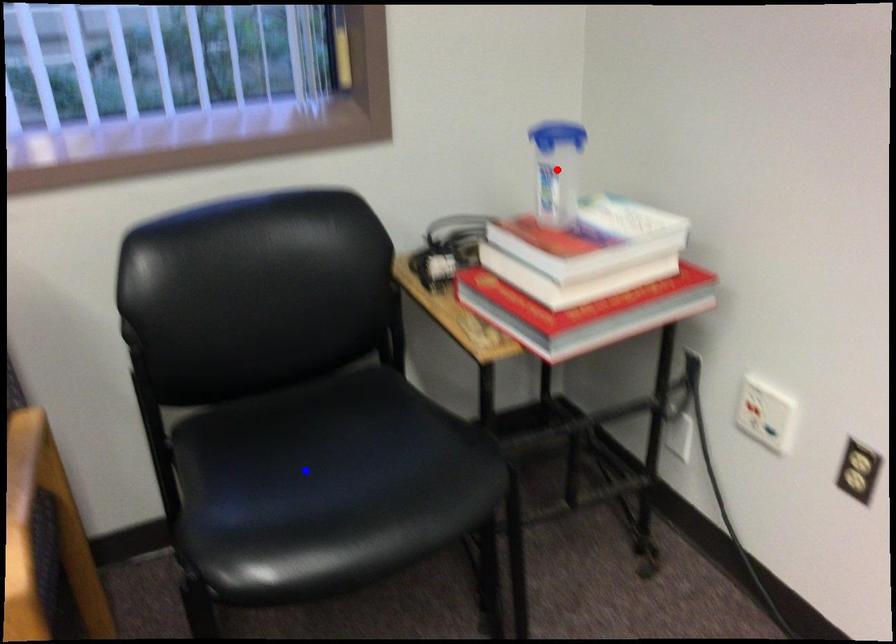
Question: Which of the two points in the image is closer to the camera?

Choices:
 (A) Blue point is closer.
 (B) Red point is closer.

Answer: (A)